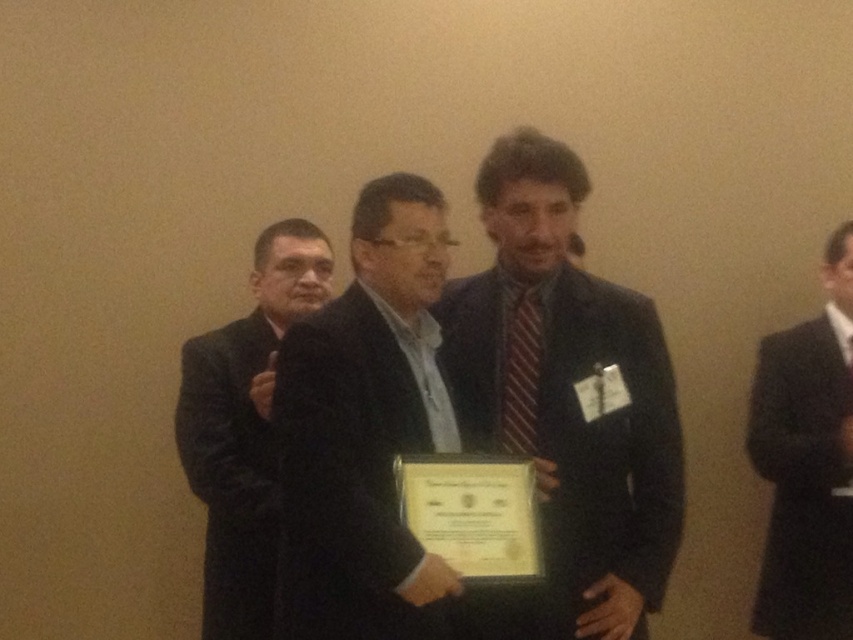
Does dark suit at center have a smaller size compared to black matte suit at center?

Incorrect, dark suit at center is not smaller in size than black matte suit at center.

Does dark suit at center have a lesser height compared to black matte suit at center?

No.

This screenshot has height=640, width=853. Identify the location of dark suit at center. (564, 404).

Identify the location of dark suit at center. (564, 404).

Does point (567, 387) come in front of point (523, 372)?

Yes, it is.

Between dark suit at center and striped fabric tie at center, which one is positioned higher?

Positioned higher is striped fabric tie at center.

You are a GUI agent. You are given a task and a screenshot of the screen. Output one action in this format:
    pyautogui.click(x=<x>, y=<y>)
    Task: Click on the dark suit at center
    The image size is (853, 640).
    Given the screenshot: What is the action you would take?
    pyautogui.click(x=564, y=404)

This screenshot has height=640, width=853. Identify the location of dark suit at center. (564, 404).

Is black matte suit at left positioned at the back of striped fabric tie at center?

That is True.

Does point (271, 440) come in front of point (511, 440)?

No, it is behind (511, 440).

Where is `black matte suit at left`? This screenshot has width=853, height=640. black matte suit at left is located at coordinates (244, 428).